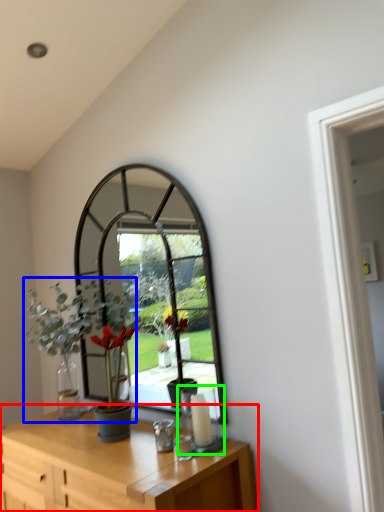
Question: Considering the real-world distances, which object is closest to table (highlighted by a red box)? houseplant (highlighted by a blue box) or candle holder (highlighted by a green box).

Choices:
 (A) houseplant
 (B) candle holder

Answer: (B)